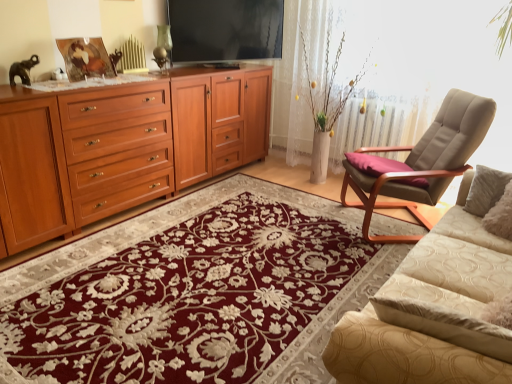
Question: From a real-world perspective, is beige fabric chair at right positioned above or below floral carpet at center?

Choices:
 (A) above
 (B) below

Answer: (A)

Question: Based on their sizes in the image, would you say beige fabric chair at right is bigger or smaller than floral carpet at center?

Choices:
 (A) big
 (B) small

Answer: (A)

Question: Which object is positioned farthest from the flat screen tv at upper center?

Choices:
 (A) purple fabric pillow at right
 (B) matte wood cabinet at left
 (C) beige fabric chair at right
 (D) matte wood drawer at left
 (E) floral carpet at center

Answer: (E)

Question: Based on their relative distances, which object is nearer to the matte wood cabinet at left?

Choices:
 (A) matte wood drawer at left
 (B) floral carpet at center
 (C) beige textured couch at lower right
 (D) purple fabric pillow at right
 (E) beige fabric chair at right

Answer: (A)